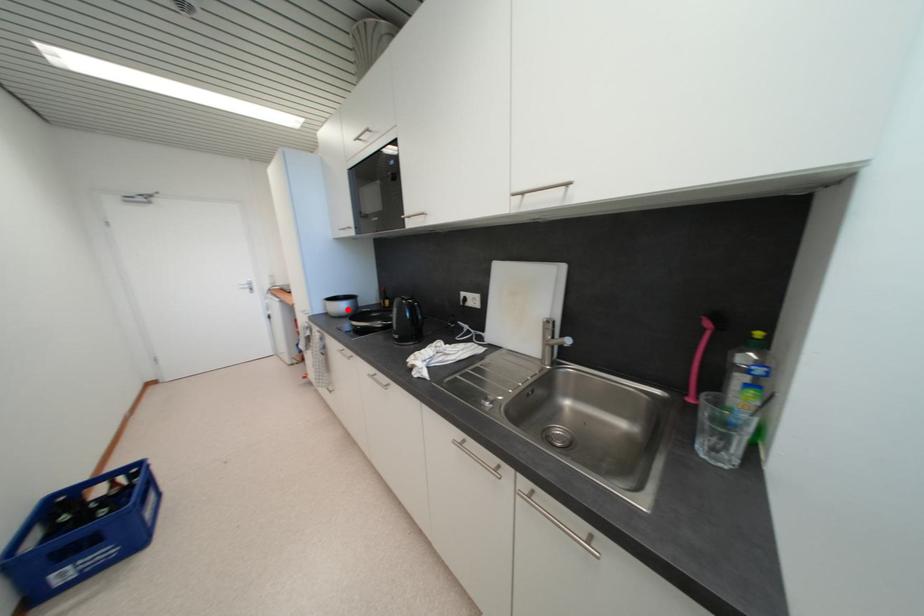
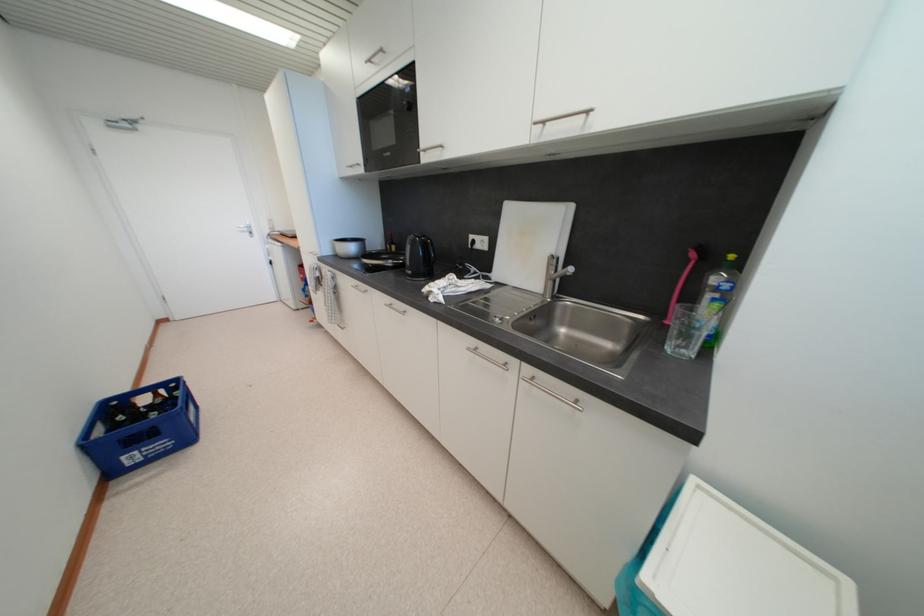
Where in the second image is the point corresponding to the highlighted location from the first image?

(357, 251)